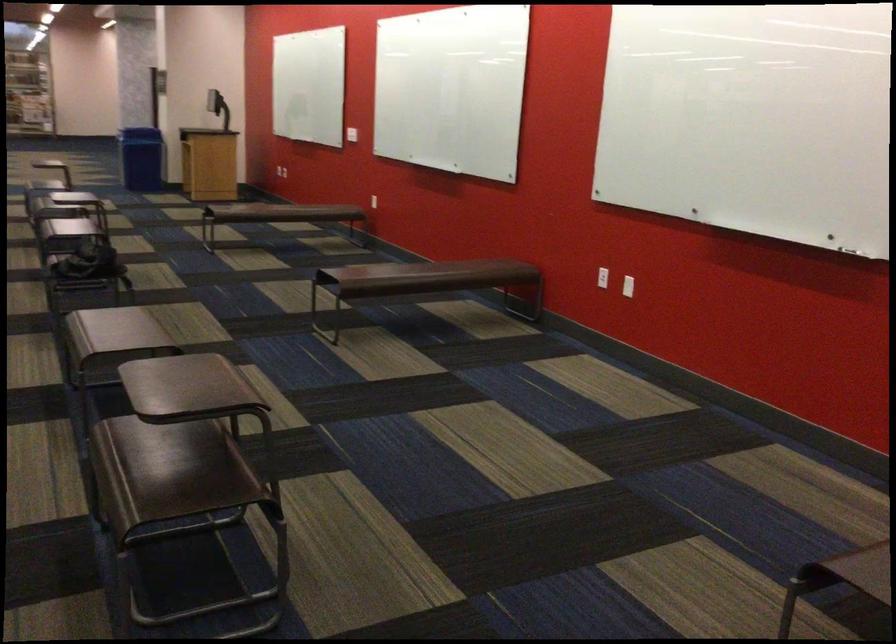
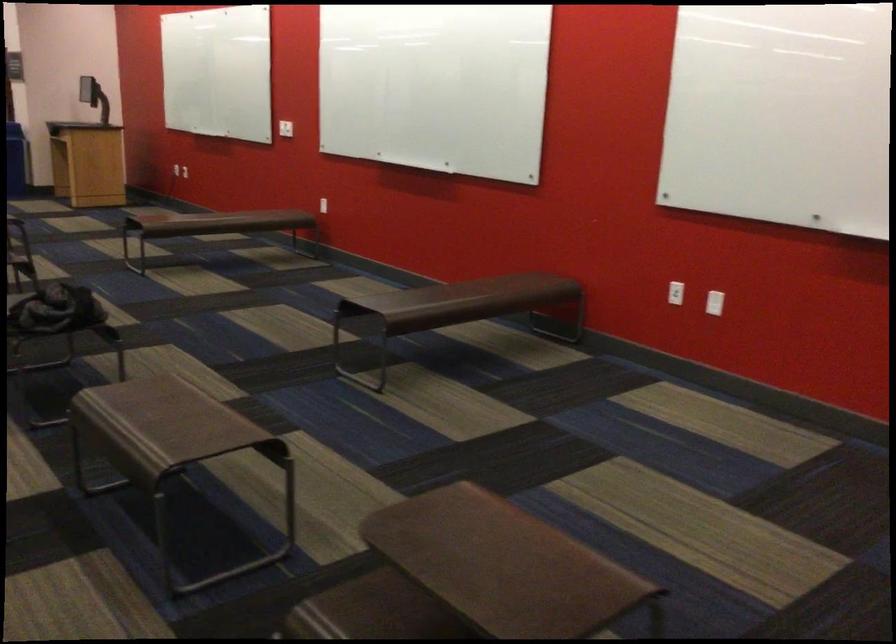
Locate, in the second image, the point that corresponds to the point at 124,336 in the first image.

(170, 420)